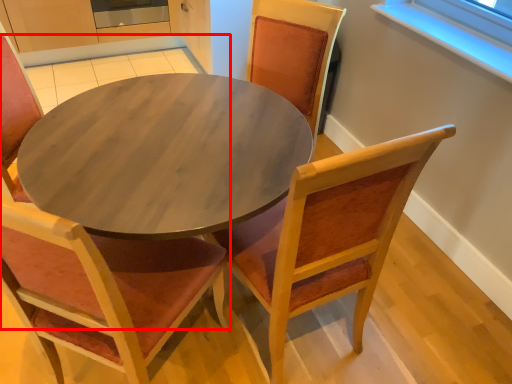
Question: From the image's perspective, where is chair (annotated by the red box) located relative to chair?

Choices:
 (A) below
 (B) above

Answer: (A)